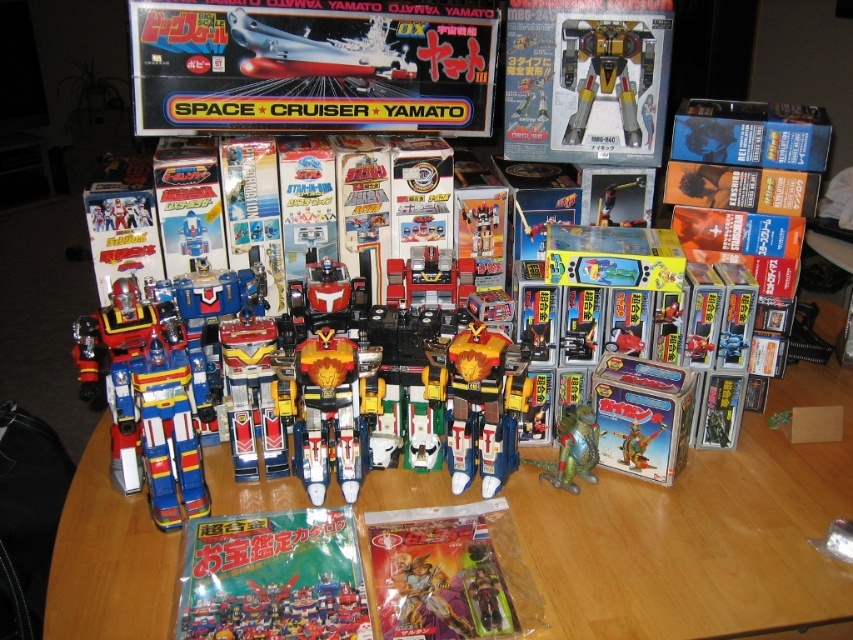
Question: Which of the following is the farthest from the observer?

Choices:
 (A) (738, 13)
 (B) (274, 616)

Answer: (A)

Question: In this image, where is wooden table at center located relative to shiny plastic robots at center?

Choices:
 (A) right
 (B) left

Answer: (B)

Question: Is wooden table at center wider than metallic silver toy at upper center?

Choices:
 (A) no
 (B) yes

Answer: (B)

Question: Which point appears farthest from the camera in this image?

Choices:
 (A) (728, 76)
 (B) (163, 29)
 (C) (582, 460)

Answer: (A)

Question: Is matte plastic action figure at center closer to the viewer compared to shiny plastic robots at center?

Choices:
 (A) yes
 (B) no

Answer: (A)

Question: Which point is farther to the camera?

Choices:
 (A) (590, 452)
 (B) (480, 44)
 (C) (379, 630)

Answer: (B)